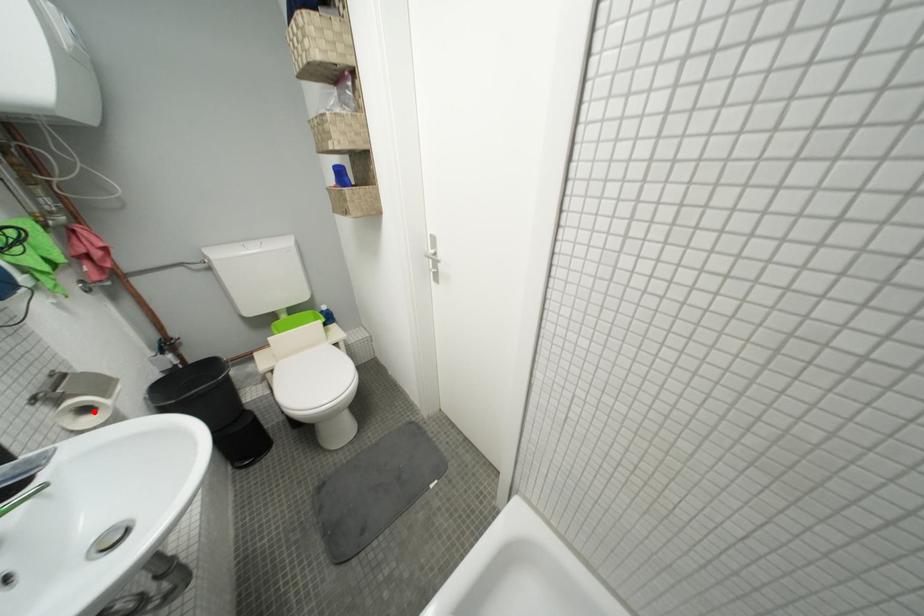
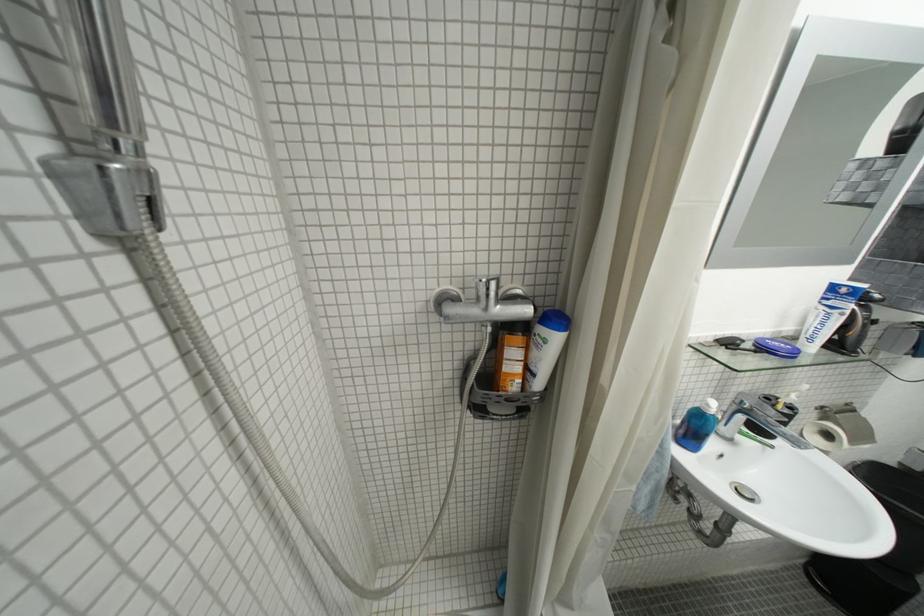
Where in the second image is the point corresponding to the highlighted location from the first image?

(836, 438)